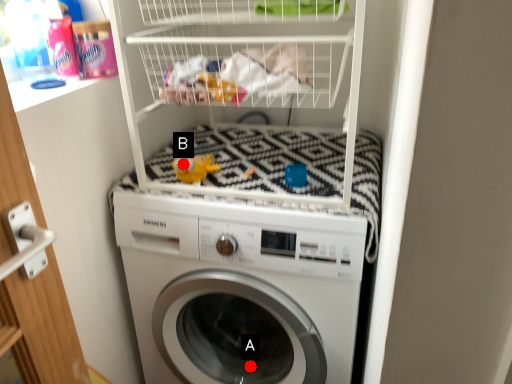
Question: Two points are circled on the image, labeled by A and B beside each circle. Which point is farther from the camera taking this photo?

Choices:
 (A) A is further
 (B) B is further

Answer: (A)